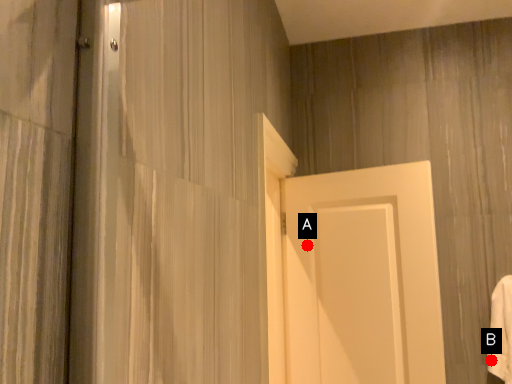
Question: Two points are circled on the image, labeled by A and B beside each circle. Which point is further to the camera?

Choices:
 (A) A is further
 (B) B is further

Answer: (A)